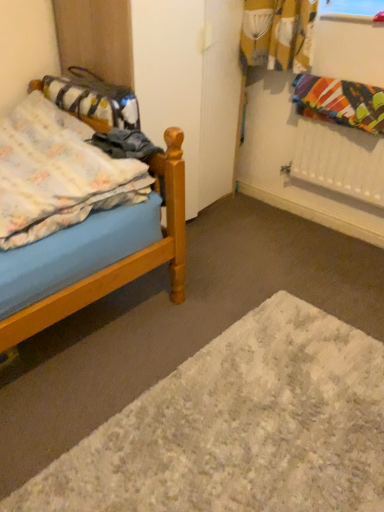
At what (x,y) coordinates should I click in order to perform the action: click on fluffy cotton blanket at left, acting as the second blanket starting from the right. Please return your answer as a coordinate pair (x, y). Image resolution: width=384 pixels, height=512 pixels. Looking at the image, I should click on (57, 173).

Measure the distance between fluffy cotton blanket at left, acting as the second blanket starting from the right, and camera.

They are 1.27 meters apart.

What is the approximate height of wooden bed at left?

31.01 inches.

This screenshot has height=512, width=384. What do you see at coordinates (120, 261) in the screenshot?
I see `wooden bed at left` at bounding box center [120, 261].

Where is `multicolored fabric at upper right, positioned as the second blanket in left-to-right order`? multicolored fabric at upper right, positioned as the second blanket in left-to-right order is located at coordinates (340, 102).

Locate an element on the screen. Image resolution: width=384 pixels, height=512 pixels. fluffy cotton blanket at left, acting as the second blanket starting from the right is located at coordinates (57, 173).

Is fluffy cotton blanket at left, the first blanket when ordered from left to right, facing away from wooden bed at left?

Yes, wooden bed at left is at the back of fluffy cotton blanket at left, the first blanket when ordered from left to right.

Which object is positioned more to the right, fluffy cotton blanket at left, the first blanket when ordered from left to right, or wooden bed at left?

From the viewer's perspective, fluffy cotton blanket at left, the first blanket when ordered from left to right, appears more on the right side.

Considering the sizes of fluffy cotton blanket at left, the first blanket when ordered from left to right, and wooden bed at left in the image, is fluffy cotton blanket at left, the first blanket when ordered from left to right, wider or thinner than wooden bed at left?

Clearly, fluffy cotton blanket at left, the first blanket when ordered from left to right, has less width compared to wooden bed at left.

Based on the photo, which is behind, fluffy cotton blanket at left, acting as the second blanket starting from the right, or wooden bed at left?

fluffy cotton blanket at left, acting as the second blanket starting from the right, is further from the camera.

Is multicolored fabric at upper right, positioned as the second blanket in left-to-right order, positioned with its back to wooden bed at left?

multicolored fabric at upper right, positioned as the second blanket in left-to-right order, does not have its back to wooden bed at left.

Where is `bed on the left of multicolored fabric at upper right, marked as the 1th blanket in a right-to-left arrangement`? This screenshot has width=384, height=512. bed on the left of multicolored fabric at upper right, marked as the 1th blanket in a right-to-left arrangement is located at coordinates (120, 261).

From a real-world perspective, does multicolored fabric at upper right, marked as the 1th blanket in a right-to-left arrangement, stand above wooden bed at left?

Yes, from a real-world perspective, multicolored fabric at upper right, marked as the 1th blanket in a right-to-left arrangement, is on top of wooden bed at left.

Is point (369, 121) positioned after point (166, 135)?

Yes, point (369, 121) is behind point (166, 135).

Measure the distance between fluffy fabric bag at left and multicolored fabric at upper right, positioned as the second blanket in left-to-right order.

3.28 feet.

Is fluffy fabric bag at left surrounding multicolored fabric at upper right, positioned as the second blanket in left-to-right order?

That's incorrect, multicolored fabric at upper right, positioned as the second blanket in left-to-right order, is not inside fluffy fabric bag at left.

Consider the image. Considering the sizes of objects fluffy fabric bag at left and multicolored fabric at upper right, positioned as the second blanket in left-to-right order, in the image provided, who is shorter, fluffy fabric bag at left or multicolored fabric at upper right, positioned as the second blanket in left-to-right order,?

Standing shorter between the two is multicolored fabric at upper right, positioned as the second blanket in left-to-right order.

Is fluffy fabric bag at left positioned far away from multicolored fabric at upper right, marked as the 1th blanket in a right-to-left arrangement?

fluffy fabric bag at left is positioned a significant distance from multicolored fabric at upper right, marked as the 1th blanket in a right-to-left arrangement.

Is fluffy cotton blanket at left, the first blanket when ordered from left to right, shorter than fluffy fabric bag at left?

Yes, fluffy cotton blanket at left, the first blanket when ordered from left to right, is shorter than fluffy fabric bag at left.

From a real-world perspective, is fluffy cotton blanket at left, acting as the second blanket starting from the right, positioned over fluffy fabric bag at left based on gravity?

No.

Considering their positions, is fluffy cotton blanket at left, the first blanket when ordered from left to right, located in front of or behind fluffy fabric bag at left?

fluffy cotton blanket at left, the first blanket when ordered from left to right, is positioned closer to the viewer than fluffy fabric bag at left.

Is fluffy cotton blanket at left, the first blanket when ordered from left to right, looking in the opposite direction of fluffy fabric bag at left?

Yes, fluffy fabric bag at left is at the back of fluffy cotton blanket at left, the first blanket when ordered from left to right.

Who is shorter, white shaggy rug at lower center or fluffy cotton blanket at left, the first blanket when ordered from left to right?

With less height is white shaggy rug at lower center.

Are white shaggy rug at lower center and fluffy cotton blanket at left, the first blanket when ordered from left to right, beside each other?

No.

Does point (125, 415) come in front of point (21, 194)?

No.

From the image's perspective, is white shaggy rug at lower center under fluffy cotton blanket at left, acting as the second blanket starting from the right?

Yes.

Image resolution: width=384 pixels, height=512 pixels. Identify the location of material behind the fluffy cotton blanket at left, acting as the second blanket starting from the right. (93, 98).

Does point (137, 109) lie in front of point (55, 133)?

No.

Can you confirm if fluffy fabric bag at left is wider than fluffy cotton blanket at left, acting as the second blanket starting from the right?

No, fluffy fabric bag at left is not wider than fluffy cotton blanket at left, acting as the second blanket starting from the right.

Does fluffy fabric bag at left touch fluffy cotton blanket at left, acting as the second blanket starting from the right?

They are not placed beside each other.

Does fluffy fabric bag at left touch wooden bed at left?

No.

Based on the photo, which of these two, fluffy fabric bag at left or wooden bed at left, is bigger?

wooden bed at left is bigger.

At what (x,y) coordinates should I click in order to perform the action: click on material behind the wooden bed at left. Please return your answer as a coordinate pair (x, y). The height and width of the screenshot is (512, 384). Looking at the image, I should click on (93, 98).

Does fluffy fabric bag at left have a lesser height compared to wooden bed at left?

Indeed, fluffy fabric bag at left has a lesser height compared to wooden bed at left.

Where is `bed on the left of fluffy cotton blanket at left, the first blanket when ordered from left to right`? The width and height of the screenshot is (384, 512). bed on the left of fluffy cotton blanket at left, the first blanket when ordered from left to right is located at coordinates (120, 261).

At what (x,y) coordinates should I click in order to perform the action: click on the 2nd blanket to the right of the wooden bed at left, starting your count from the anchor. Please return your answer as a coordinate pair (x, y). The height and width of the screenshot is (512, 384). Looking at the image, I should click on (340, 102).

When comparing their distances from fluffy cotton blanket at left, acting as the second blanket starting from the right, does fluffy fabric bag at left or multicolored fabric at upper right, marked as the 1th blanket in a right-to-left arrangement, seem closer?

The object closer to fluffy cotton blanket at left, acting as the second blanket starting from the right, is fluffy fabric bag at left.

Estimate the real-world distances between objects in this image. Which object is further from white shaggy rug at lower center, fluffy fabric bag at left or fluffy cotton blanket at left, acting as the second blanket starting from the right?

The object further to white shaggy rug at lower center is fluffy fabric bag at left.

Looking at the image, which one is located further to white shaggy rug at lower center, multicolored fabric at upper right, positioned as the second blanket in left-to-right order, or fluffy fabric bag at left?

multicolored fabric at upper right, positioned as the second blanket in left-to-right order.

From the image, which object appears to be nearer to fluffy fabric bag at left, multicolored fabric at upper right, marked as the 1th blanket in a right-to-left arrangement, or wooden bed at left?

wooden bed at left is closer to fluffy fabric bag at left.

Based on their spatial positions, is wooden bed at left or fluffy cotton blanket at left, the first blanket when ordered from left to right, further from multicolored fabric at upper right, positioned as the second blanket in left-to-right order?

fluffy cotton blanket at left, the first blanket when ordered from left to right.

Estimate the real-world distances between objects in this image. Which object is further from white shaggy rug at lower center, fluffy fabric bag at left or multicolored fabric at upper right, positioned as the second blanket in left-to-right order?

multicolored fabric at upper right, positioned as the second blanket in left-to-right order, lies further to white shaggy rug at lower center than the other object.

From the image, which object appears to be farther from fluffy cotton blanket at left, the first blanket when ordered from left to right, white shaggy rug at lower center or fluffy fabric bag at left?

white shaggy rug at lower center.

Based on their spatial positions, is fluffy cotton blanket at left, acting as the second blanket starting from the right, or wooden bed at left further from fluffy fabric bag at left?

Based on the image, wooden bed at left appears to be further to fluffy fabric bag at left.

Identify the location of plain located between wooden bed at left and multicolored fabric at upper right, marked as the 1th blanket in a right-to-left arrangement, in the left-right direction. The width and height of the screenshot is (384, 512). (239, 426).

You are a GUI agent. You are given a task and a screenshot of the screen. Output one action in this format:
    pyautogui.click(x=<x>, y=<y>)
    Task: Click on the material between fluffy cotton blanket at left, acting as the second blanket starting from the right, and multicolored fabric at upper right, positioned as the second blanket in left-to-right order, in the horizontal direction
    The height and width of the screenshot is (512, 384).
    Given the screenshot: What is the action you would take?
    pyautogui.click(x=93, y=98)

Find the location of `blanket between fluffy fabric bag at left and white shaggy rug at lower center from top to bottom`. blanket between fluffy fabric bag at left and white shaggy rug at lower center from top to bottom is located at coordinates (57, 173).

Where is `bed that lies between fluffy cotton blanket at left, acting as the second blanket starting from the right, and white shaggy rug at lower center from top to bottom`? The image size is (384, 512). bed that lies between fluffy cotton blanket at left, acting as the second blanket starting from the right, and white shaggy rug at lower center from top to bottom is located at coordinates (120, 261).